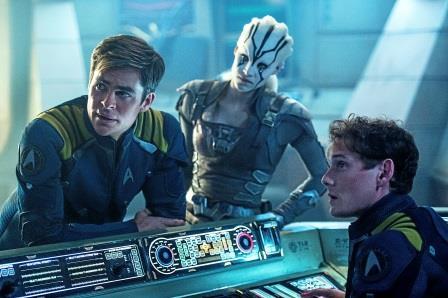
Where is `walls`? walls is located at coordinates (407, 70).